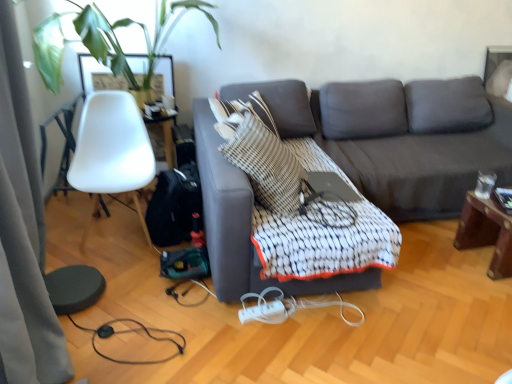
I want to click on vacant space to the left of mahogany wood side table at right, so click(431, 256).